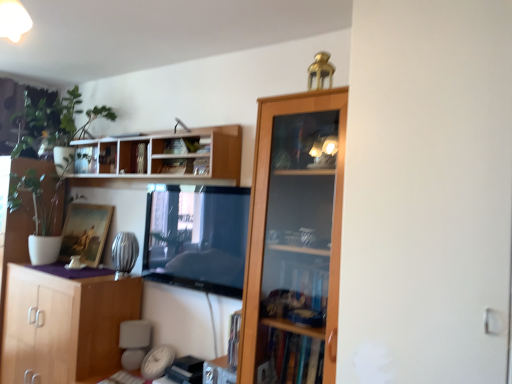
Question: Is hardcover book at upper center, which is the 1th book from right to left, closer to the viewer compared to white glossy screen door at right?

Choices:
 (A) yes
 (B) no

Answer: (B)

Question: Does hardcover book at upper center, which is counted as the 3th book, starting from the left, have a lesser height compared to white glossy screen door at right?

Choices:
 (A) yes
 (B) no

Answer: (A)

Question: Is hardcover book at upper center, which is the 1th book from right to left, wider than white glossy screen door at right?

Choices:
 (A) no
 (B) yes

Answer: (A)

Question: Considering the relative sizes of hardcover book at upper center, which is the 1th book from right to left, and white glossy screen door at right in the image provided, is hardcover book at upper center, which is the 1th book from right to left, bigger than white glossy screen door at right?

Choices:
 (A) yes
 (B) no

Answer: (B)

Question: From a real-world perspective, is hardcover book at upper center, which is the 1th book from right to left, on white glossy screen door at right?

Choices:
 (A) no
 (B) yes

Answer: (B)

Question: In terms of size, does metallic silver book at upper center, the 3th book when ordered from right to left, appear bigger or smaller than hardcover book at upper center, which is the 1th book from right to left?

Choices:
 (A) small
 (B) big

Answer: (B)

Question: Considering the positions of metallic silver book at upper center, the 3th book when ordered from right to left, and hardcover book at upper center, which is the 1th book from right to left, in the image, is metallic silver book at upper center, the 3th book when ordered from right to left, taller or shorter than hardcover book at upper center, which is the 1th book from right to left,?

Choices:
 (A) short
 (B) tall

Answer: (B)

Question: Considering the positions of point (132, 147) and point (184, 145), is point (132, 147) closer or farther from the camera than point (184, 145)?

Choices:
 (A) farther
 (B) closer

Answer: (A)

Question: In terms of width, does metallic silver book at upper center, the 3th book when ordered from right to left, look wider or thinner when compared to hardcover book at upper center, which is the 1th book from right to left?

Choices:
 (A) thin
 (B) wide

Answer: (A)

Question: From a real-world perspective, is metallic silver book at upper center, the 1th book viewed from the left, physically located above or below wooden cabinet at lower left?

Choices:
 (A) above
 (B) below

Answer: (A)

Question: In terms of height, does metallic silver book at upper center, the 3th book when ordered from right to left, look taller or shorter compared to wooden cabinet at lower left?

Choices:
 (A) short
 (B) tall

Answer: (A)

Question: Is point (134, 144) positioned closer to the camera than point (14, 372)?

Choices:
 (A) farther
 (B) closer

Answer: (B)

Question: Considering the positions of metallic silver book at upper center, the 3th book when ordered from right to left, and wooden cabinet at lower left in the image, is metallic silver book at upper center, the 3th book when ordered from right to left, wider or thinner than wooden cabinet at lower left?

Choices:
 (A) thin
 (B) wide

Answer: (A)

Question: Which is correct: white wood shelves at upper center is inside hardcover book at upper center, the 2th book in the right-to-left sequence, or outside of it?

Choices:
 (A) outside
 (B) inside

Answer: (A)

Question: Is white wood shelves at upper center bigger or smaller than hardcover book at upper center, the 2th book when ordered from left to right?

Choices:
 (A) small
 (B) big

Answer: (B)